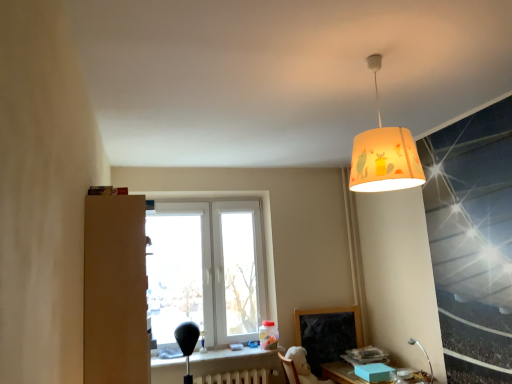
Question: Do you think matte black table at lower center, which ranks as the second table in right-to-left order, is within matte yellow lampshade at upper center, or outside of it?

Choices:
 (A) inside
 (B) outside

Answer: (B)

Question: Considering the positions of matte black table at lower center, which ranks as the second table in right-to-left order, and matte yellow lampshade at upper center in the image, is matte black table at lower center, which ranks as the second table in right-to-left order, bigger or smaller than matte yellow lampshade at upper center?

Choices:
 (A) small
 (B) big

Answer: (A)

Question: Which object is positioned closest to the matte yellow lampshade at upper center?

Choices:
 (A) flexible metal table lamp at lower right
 (B) matte wooden table at lower right, which is counted as the second table, starting from the left
 (C) matte black table at lower center, the 1th table viewed from the left
 (D) white painted metal radiator at lower center
 (E) white plastic window at center

Answer: (B)

Question: Which is nearer to the matte yellow lampshade at upper center?

Choices:
 (A) matte wooden table at lower right, which is counted as the second table, starting from the left
 (B) matte black table at lower center, the 1th table viewed from the left
 (C) white plastic window at center
 (D) white painted metal radiator at lower center
 (E) flexible metal table lamp at lower right

Answer: (A)